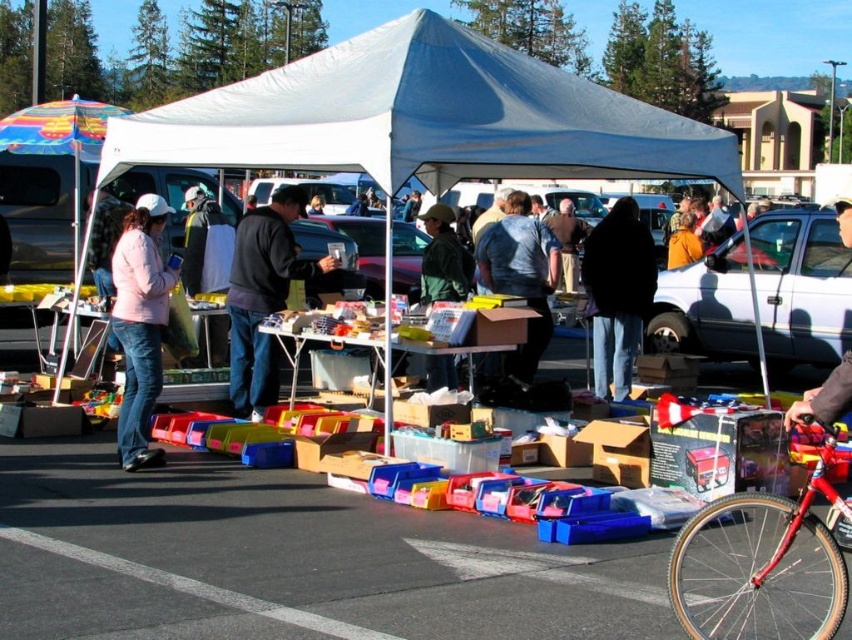
Consider the image. Is white fabric canopy at upper center in front of green fabric jacket at center?

That is True.

The width and height of the screenshot is (852, 640). I want to click on white fabric canopy at upper center, so click(x=423, y=118).

Who is more distant from viewer, [672,140] or [435,230]?

The point [435,230] is behind.

Find the location of a particular element. The height and width of the screenshot is (640, 852). white fabric canopy at upper center is located at coordinates (423, 118).

Does green fabric jacket at center have a lesser height compared to orange fleece jacket at center?

No.

Can you confirm if green fabric jacket at center is positioned to the right of orange fleece jacket at center?

In fact, green fabric jacket at center is to the left of orange fleece jacket at center.

Does point (418, 216) lie behind point (684, 230)?

Yes, it is behind point (684, 230).

Where is `green fabric jacket at center`? green fabric jacket at center is located at coordinates (442, 259).

Does pink fleece jacket at left have a larger size compared to orange fleece jacket at center?

Actually, pink fleece jacket at left might be smaller than orange fleece jacket at center.

Between point (165, 300) and point (678, 250), which one is positioned in front?

Positioned in front is point (165, 300).

The height and width of the screenshot is (640, 852). In order to click on pink fleece jacket at left in this screenshot , I will do `click(140, 324)`.